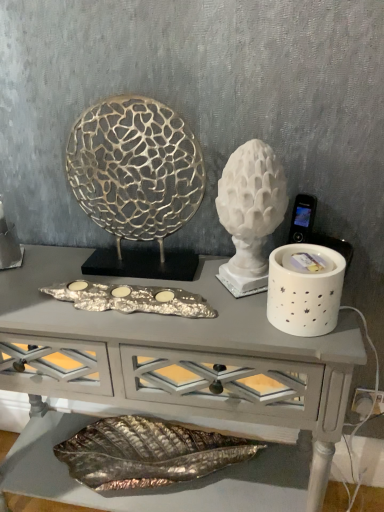
The width and height of the screenshot is (384, 512). I want to click on white glossy candle holder at upper right, so click(x=180, y=356).

What is the approximate height of silver metallic tray at center?

The height of silver metallic tray at center is 2.41 centimeters.

Locate an element on the screen. The image size is (384, 512). white glossy candle holder at upper right is located at coordinates click(x=180, y=356).

Is white marble sculpture at center, which appears as the first sculpture when viewed from the right, positioned with its back to white glossy candle holder at upper right?

No, white glossy candle holder at upper right is not at the back of white marble sculpture at center, which appears as the first sculpture when viewed from the right.

Is white marble sculpture at center, which is the second sculpture from left to right, in front of or behind white glossy candle holder at upper right in the image?

white marble sculpture at center, which is the second sculpture from left to right, is behind white glossy candle holder at upper right.

Can you tell me how much white marble sculpture at center, which is the second sculpture from left to right, and white glossy candle holder at upper right differ in facing direction?

The facing directions of white marble sculpture at center, which is the second sculpture from left to right, and white glossy candle holder at upper right are 0.00211 degrees apart.

From a real-world perspective, relative to white glossy candle holder at upper right, is white marble sculpture at center, which is the second sculpture from left to right, vertically above or below?

white marble sculpture at center, which is the second sculpture from left to right, is situated higher than white glossy candle holder at upper right in the real world.

Considering the relative sizes of gold textured sculpture at center, the 1th sculpture from the left, and white glossy candle holder at upper right in the image provided, is gold textured sculpture at center, the 1th sculpture from the left, taller than white glossy candle holder at upper right?

Incorrect, the height of gold textured sculpture at center, the 1th sculpture from the left, is not larger of that of white glossy candle holder at upper right.

Does gold textured sculpture at center, the second sculpture viewed from the right, turn towards white glossy candle holder at upper right?

No, gold textured sculpture at center, the second sculpture viewed from the right, is not facing towards white glossy candle holder at upper right.

Is white glossy candle holder at upper right completely or partially inside gold textured sculpture at center, the second sculpture viewed from the right?

No, white glossy candle holder at upper right is located outside of gold textured sculpture at center, the second sculpture viewed from the right.

Considering the relative sizes of gold textured sculpture at center, the 1th sculpture from the left, and white glossy candle holder at upper right in the image provided, is gold textured sculpture at center, the 1th sculpture from the left, smaller than white glossy candle holder at upper right?

Correct, gold textured sculpture at center, the 1th sculpture from the left, occupies less space than white glossy candle holder at upper right.

Is white ceramic candle holder at right oriented towards silver metallic tray at center?

No, white ceramic candle holder at right is not facing towards silver metallic tray at center.

Which of these two, white ceramic candle holder at right or silver metallic tray at center, stands shorter?

With less height is silver metallic tray at center.

From the image's perspective, which is below, white ceramic candle holder at right or silver metallic tray at center?

silver metallic tray at center, from the image's perspective.

Is white glossy candle holder at upper right touching silver metallic tray at center?

No, white glossy candle holder at upper right is not next to silver metallic tray at center.

Between white glossy candle holder at upper right and silver metallic tray at center, which one has more height?

With more height is white glossy candle holder at upper right.

Which of these two, white glossy candle holder at upper right or silver metallic tray at center, is thinner?

silver metallic tray at center.

Image resolution: width=384 pixels, height=512 pixels. What are the coordinates of `art that appears above the white glossy candle holder at upper right (from a real-world perspective)` in the screenshot? It's located at (132, 298).

Is white marble sculpture at center, which is the second sculpture from left to right, inside silver metallic tray at center?

No, silver metallic tray at center does not contain white marble sculpture at center, which is the second sculpture from left to right.

Does silver metallic tray at center have a greater height compared to white marble sculpture at center, which appears as the first sculpture when viewed from the right?

In fact, silver metallic tray at center may be shorter than white marble sculpture at center, which appears as the first sculpture when viewed from the right.

Between silver metallic tray at center and white marble sculpture at center, which appears as the first sculpture when viewed from the right, which one is positioned behind?

silver metallic tray at center is behind.

Is point (79, 306) closer to camera compared to point (255, 263)?

Yes, point (79, 306) is in front of point (255, 263).

Which of these two, white glossy candle holder at upper right or gold textured sculpture at center, the second sculpture viewed from the right, stands taller?

white glossy candle holder at upper right.

Would you say white glossy candle holder at upper right is inside or outside gold textured sculpture at center, the second sculpture viewed from the right?

white glossy candle holder at upper right exists outside the volume of gold textured sculpture at center, the second sculpture viewed from the right.

Which is nearer, (x=59, y=395) or (x=182, y=132)?

Positioned in front is point (x=182, y=132).

How far apart are white glossy candle holder at upper right and gold textured sculpture at center, the second sculpture viewed from the right?

white glossy candle holder at upper right and gold textured sculpture at center, the second sculpture viewed from the right, are 8.47 inches apart from each other.

Based on their sizes in the image, would you say white marble sculpture at center, which appears as the first sculpture when viewed from the right, is bigger or smaller than gold textured sculpture at center, the second sculpture viewed from the right?

Considering their sizes, white marble sculpture at center, which appears as the first sculpture when viewed from the right, takes up less space than gold textured sculpture at center, the second sculpture viewed from the right.

Would you consider white marble sculpture at center, which is the second sculpture from left to right, to be distant from gold textured sculpture at center, the 1th sculpture from the left?

No.

Is white marble sculpture at center, which is the second sculpture from left to right, oriented away from gold textured sculpture at center, the second sculpture viewed from the right?

No, gold textured sculpture at center, the second sculpture viewed from the right, is not at the back of white marble sculpture at center, which is the second sculpture from left to right.

Is point (226, 168) closer or farther from the camera than point (71, 159)?

Clearly, point (226, 168) is closer to the camera than point (71, 159).

This screenshot has height=512, width=384. I want to click on the 2nd sculpture counting from the right of the white glossy candle holder at upper right, so click(250, 213).

Identify the location of the 2nd sculpture behind when counting from the white glossy candle holder at upper right. The height and width of the screenshot is (512, 384). (136, 183).

Based on their spatial positions, is white glossy candle holder at upper right or white marble sculpture at center, which appears as the first sculpture when viewed from the right, closer to white ceramic candle holder at right?

white marble sculpture at center, which appears as the first sculpture when viewed from the right, is positioned closer to the anchor white ceramic candle holder at right.

Considering their positions, is white ceramic candle holder at right positioned closer to white glossy candle holder at upper right than gold textured sculpture at center, the 1th sculpture from the left?

gold textured sculpture at center, the 1th sculpture from the left, is closer to white glossy candle holder at upper right.

Based on their spatial positions, is white marble sculpture at center, which is the second sculpture from left to right, or white glossy candle holder at upper right further from silver metallic tray at center?

white marble sculpture at center, which is the second sculpture from left to right, is further to silver metallic tray at center.

Based on their spatial positions, is white marble sculpture at center, which appears as the first sculpture when viewed from the right, or gold textured sculpture at center, the second sculpture viewed from the right, further from silver metallic tray at center?

gold textured sculpture at center, the second sculpture viewed from the right, lies further to silver metallic tray at center than the other object.

Looking at the image, which one is located closer to silver metallic tray at center, gold textured sculpture at center, the 1th sculpture from the left, or white glossy candle holder at upper right?

The object closer to silver metallic tray at center is white glossy candle holder at upper right.

When comparing their distances from white glossy candle holder at upper right, does silver metallic tray at center or white marble sculpture at center, which appears as the first sculpture when viewed from the right, seem closer?

Based on the image, silver metallic tray at center appears to be nearer to white glossy candle holder at upper right.

From the picture: When comparing their distances from white ceramic candle holder at right, does gold textured sculpture at center, the 1th sculpture from the left, or white glossy candle holder at upper right seem further?

Based on the image, gold textured sculpture at center, the 1th sculpture from the left, appears to be further to white ceramic candle holder at right.

Considering their positions, is white ceramic candle holder at right positioned closer to gold textured sculpture at center, the second sculpture viewed from the right, than silver metallic tray at center?

Among the two, silver metallic tray at center is located nearer to gold textured sculpture at center, the second sculpture viewed from the right.

Locate an element on the screen. sculpture located between gold textured sculpture at center, the second sculpture viewed from the right, and white ceramic candle holder at right in the left-right direction is located at coordinates (250, 213).

Where is `art that lies between white ceramic candle holder at right and white glossy candle holder at upper right from top to bottom`? Image resolution: width=384 pixels, height=512 pixels. art that lies between white ceramic candle holder at right and white glossy candle holder at upper right from top to bottom is located at coordinates (132, 298).

Where is `art between white marble sculpture at center, which is the second sculpture from left to right, and white glossy candle holder at upper right vertically`? This screenshot has width=384, height=512. art between white marble sculpture at center, which is the second sculpture from left to right, and white glossy candle holder at upper right vertically is located at coordinates (132, 298).

Locate an element on the screen. This screenshot has height=512, width=384. sculpture that lies between gold textured sculpture at center, the second sculpture viewed from the right, and white glossy candle holder at upper right from top to bottom is located at coordinates (250, 213).